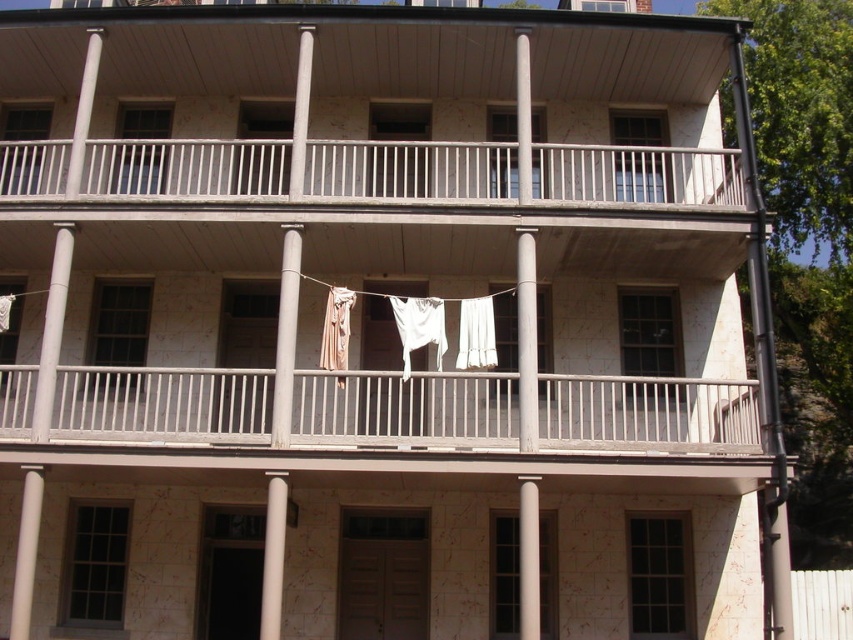
Between wooden railings at center and white fabric at center, which one has less height?

Standing shorter between the two is white fabric at center.

You are a GUI agent. You are given a task and a screenshot of the screen. Output one action in this format:
    pyautogui.click(x=<x>, y=<y>)
    Task: Click on the wooden railings at center
    This screenshot has height=640, width=853.
    Given the screenshot: What is the action you would take?
    pyautogui.click(x=405, y=408)